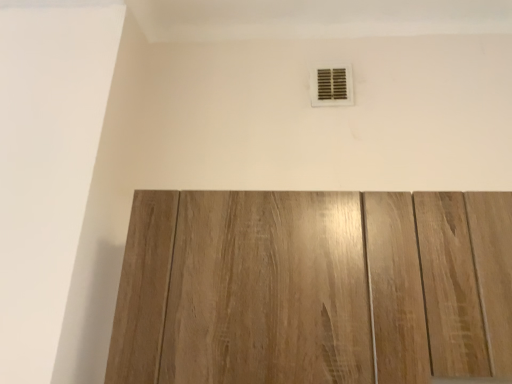
Question: Would you say matte plastic vent at upper center is to the left or to the right of light brown wood door at center in the picture?

Choices:
 (A) left
 (B) right

Answer: (B)

Question: Considering the positions of matte plastic vent at upper center and light brown wood door at center in the image, is matte plastic vent at upper center taller or shorter than light brown wood door at center?

Choices:
 (A) short
 (B) tall

Answer: (A)

Question: Considering their positions, is matte plastic vent at upper center located in front of or behind light brown wood door at center?

Choices:
 (A) front
 (B) behind

Answer: (B)

Question: Is light brown wood door at center taller or shorter than matte plastic vent at upper center?

Choices:
 (A) short
 (B) tall

Answer: (B)

Question: Is light brown wood door at center inside the boundaries of matte plastic vent at upper center, or outside?

Choices:
 (A) inside
 (B) outside

Answer: (B)

Question: Is light brown wood door at center bigger or smaller than matte plastic vent at upper center?

Choices:
 (A) big
 (B) small

Answer: (A)

Question: Is point (265, 377) closer or farther from the camera than point (335, 94)?

Choices:
 (A) farther
 (B) closer

Answer: (B)